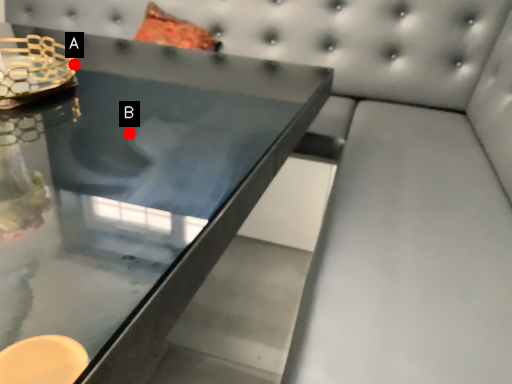
Question: Two points are circled on the image, labeled by A and B beside each circle. Which point is closer to the camera?

Choices:
 (A) A is closer
 (B) B is closer

Answer: (B)